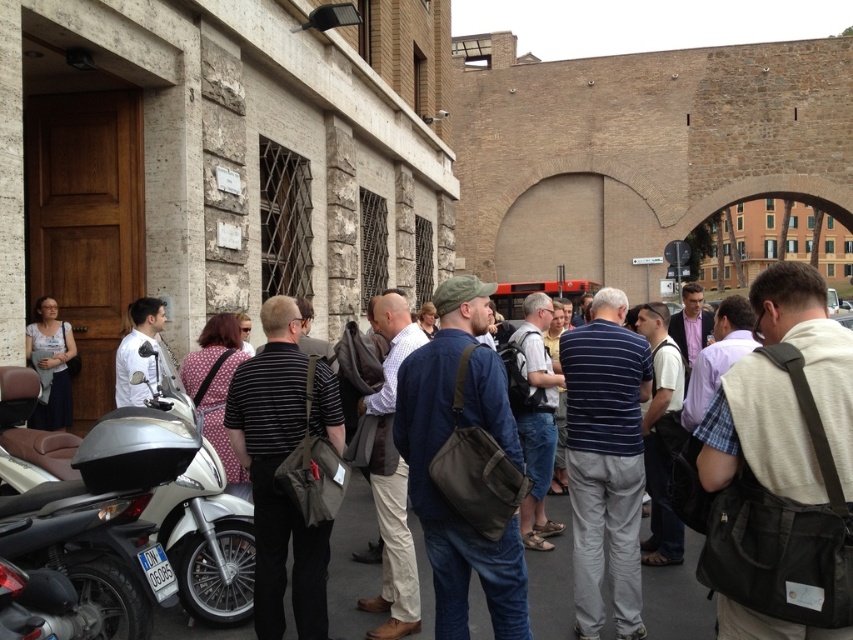
Question: Is silver metallic scooter at lower left positioned in front of dark blue jeans at center?

Choices:
 (A) yes
 (B) no

Answer: (B)

Question: In this image, where is silver metallic scooter at lower left located relative to dark blue jeans at center?

Choices:
 (A) left
 (B) right

Answer: (A)

Question: Which point is closer to the camera?

Choices:
 (A) (473, 593)
 (B) (193, 604)

Answer: (B)

Question: Is silver metallic scooter at lower left to the left of dark blue jeans at center from the viewer's perspective?

Choices:
 (A) yes
 (B) no

Answer: (A)